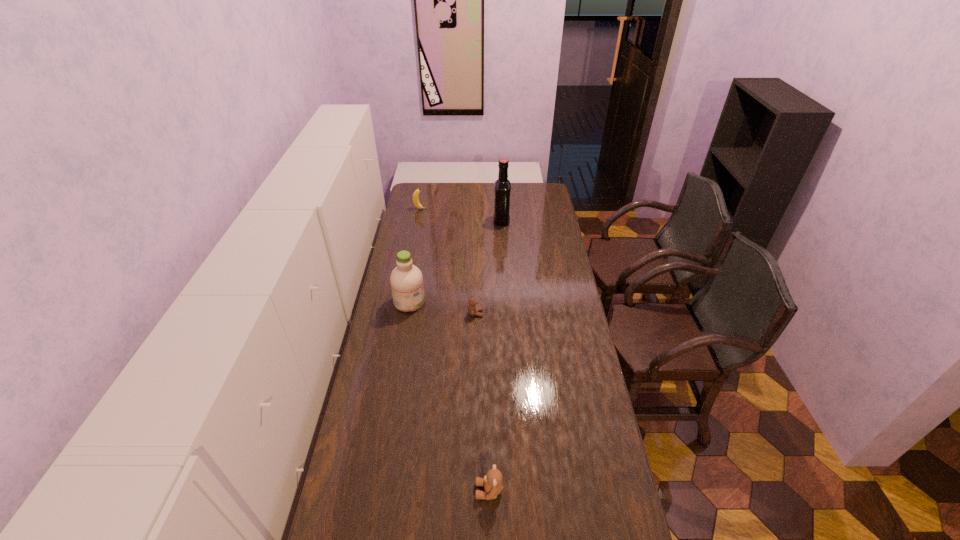
The width and height of the screenshot is (960, 540). What are the coordinates of `liquor` in the screenshot? It's located at (501, 217).

Where is `the second farthest object`? The image size is (960, 540). the second farthest object is located at coordinates (501, 217).

In order to click on cleansing agent in this screenshot , I will do `click(406, 280)`.

You are a GUI agent. You are given a task and a screenshot of the screen. Output one action in this format:
    pyautogui.click(x=<x>, y=<y>)
    Task: Click on the third tallest object
    The width and height of the screenshot is (960, 540).
    Given the screenshot: What is the action you would take?
    pyautogui.click(x=416, y=202)

Find the location of a particular element. This screenshot has height=540, width=960. the farthest object is located at coordinates (416, 202).

Find the location of a particular element. the nearer teddy bear is located at coordinates (492, 481).

You are a GUI agent. You are given a task and a screenshot of the screen. Output one action in this format:
    pyautogui.click(x=<x>, y=<y>)
    Task: Click on the shortest object
    
    Given the screenshot: What is the action you would take?
    pyautogui.click(x=472, y=309)

The height and width of the screenshot is (540, 960). I want to click on the shorter teddy bear, so click(472, 309).

Where is `vacant space located on the front-facing side of the rightmost object`? vacant space located on the front-facing side of the rightmost object is located at coordinates (437, 221).

The image size is (960, 540). Find the location of `free location located 0.280m on the front-facing side of the rightmost object`. free location located 0.280m on the front-facing side of the rightmost object is located at coordinates (443, 221).